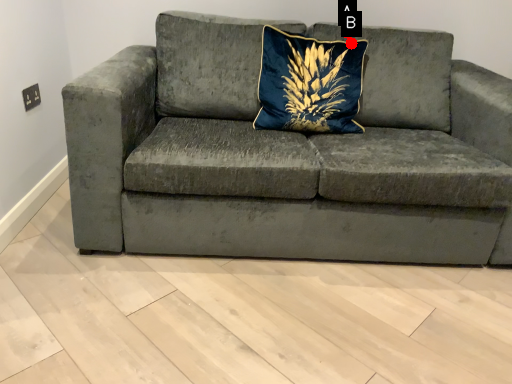
Question: Two points are circled on the image, labeled by A and B beside each circle. Which point is farther to the camera?

Choices:
 (A) A is further
 (B) B is further

Answer: (A)